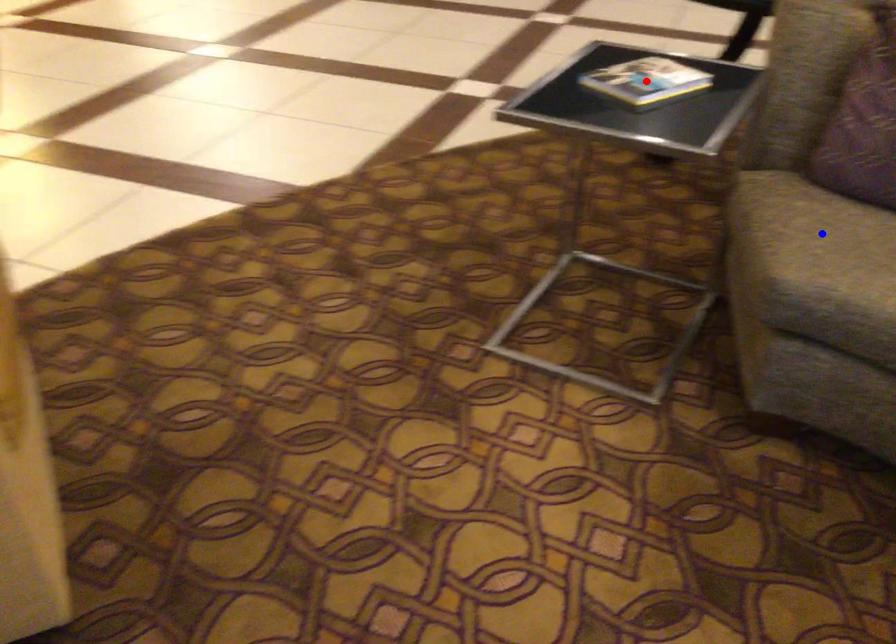
Question: Which of the two points in the image is closer to the camera?

Choices:
 (A) Blue point is closer.
 (B) Red point is closer.

Answer: (A)